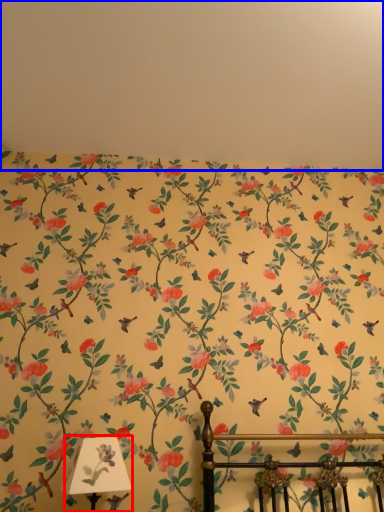
Question: Which point is closer to the camera, table lamp (highlighted by a red box) or backdrop (highlighted by a blue box)?

Choices:
 (A) table lamp
 (B) backdrop

Answer: (A)